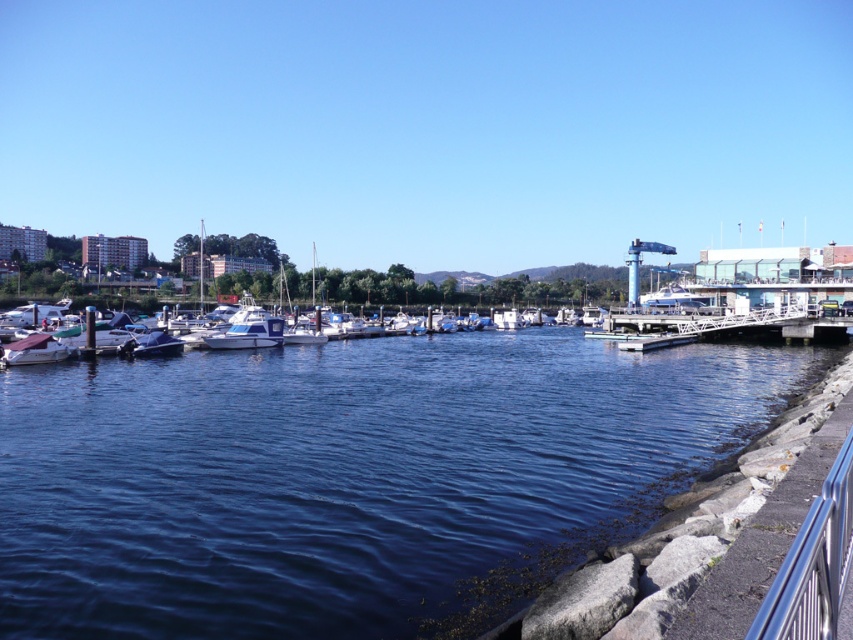
You are standing at the concrete embankment on the right side of the marina. You want to know the exact position of the blue water at center. Can you tell me its coordinates?

The blue water at center is located at point [351,477].

You are standing at the concrete embankment with a metal railing on the right side of the marina scene. You notice two points marked in the image. Which point, point (97, 390) or point (59, 349), is closer to your current position?

Point (97, 390) is closer to your current position because it is in front of point (59, 349).